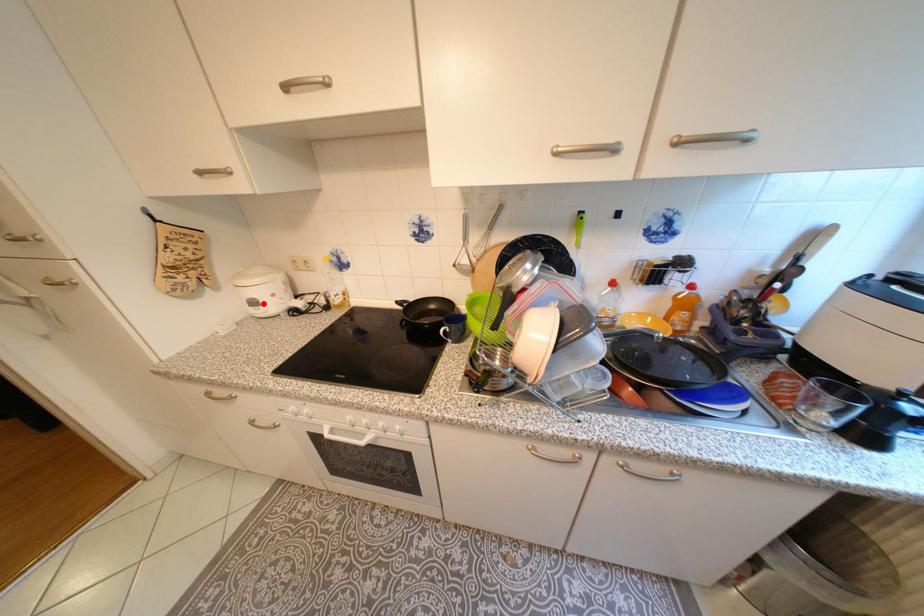
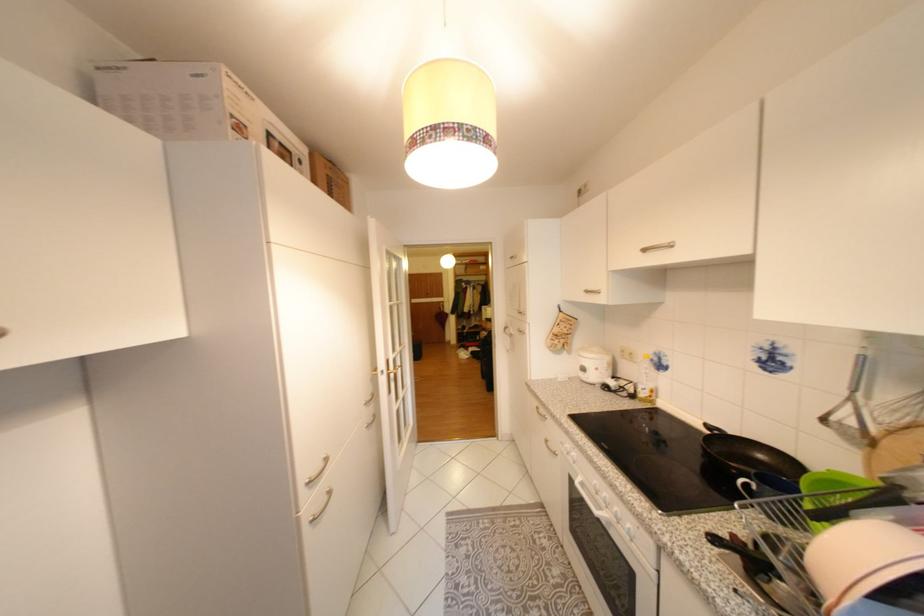
Question: I am providing you with two images of the same scene from different viewpoints. Given a red point in image1, look at the same physical point in image2. Is it:

Choices:
 (A) Closer to the viewpoint
 (B) Farther from the viewpoint

Answer: (B)